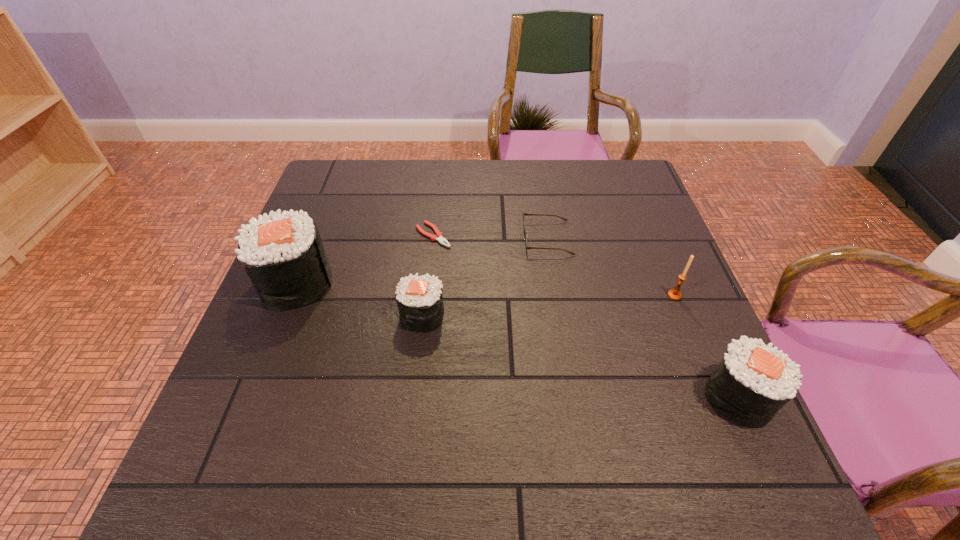
Locate an element on the screen. sushi that is at the right edge is located at coordinates (753, 381).

Find the location of a particular element. This screenshot has width=960, height=540. candle_holder at the right edge is located at coordinates (674, 294).

The height and width of the screenshot is (540, 960). I want to click on object that is at the near right corner, so click(753, 381).

The image size is (960, 540). In order to click on vacant region at the far edge of the desktop in this screenshot , I will do `click(545, 192)`.

The width and height of the screenshot is (960, 540). In the image, there is a desktop. What are the coordinates of `vacant region at the near edge` in the screenshot? It's located at (644, 422).

This screenshot has height=540, width=960. Find the location of `free space at the left edge of the desktop`. free space at the left edge of the desktop is located at coordinates (294, 320).

I want to click on vacant space at the near left corner of the desktop, so click(x=238, y=419).

Identify the location of free point at the far right corner. (605, 184).

This screenshot has width=960, height=540. Identify the location of free space between the shortest sushi and the second tallest sushi. (581, 356).

Locate an element on the screen. The height and width of the screenshot is (540, 960). free spot between the pliers and the candle_holder is located at coordinates 554,265.